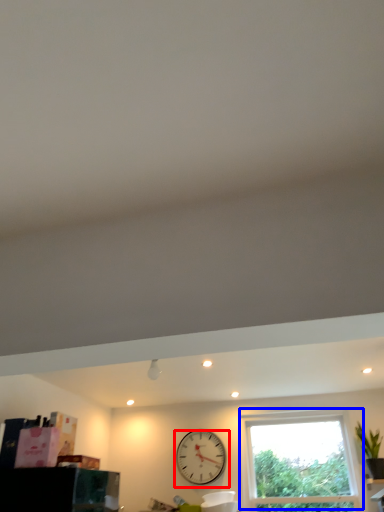
Question: Which of the following is the closest to the observer, wall clock (highlighted by a red box) or window (highlighted by a blue box)?

Choices:
 (A) wall clock
 (B) window

Answer: (B)